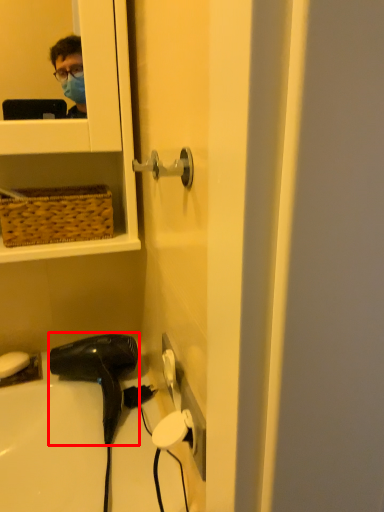
Question: In this image, where is hair drier (annotated by the red box) located relative to soap?

Choices:
 (A) left
 (B) right

Answer: (B)